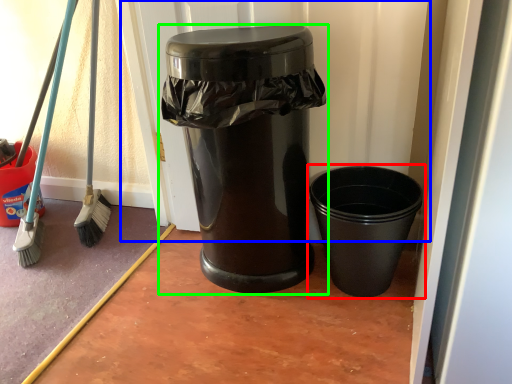
Question: Considering the real-world distances, which object is closest to waste container (highlighted by a red box)? screen door (highlighted by a blue box) or waste container (highlighted by a green box).

Choices:
 (A) screen door
 (B) waste container

Answer: (B)